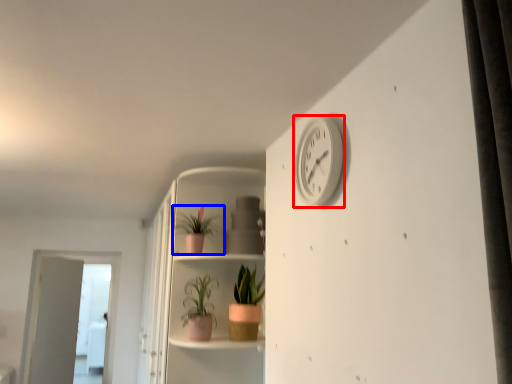
Question: Which object appears closest to the camera in this image, clock (highlighted by a red box) or houseplant (highlighted by a blue box)?

Choices:
 (A) clock
 (B) houseplant

Answer: (A)